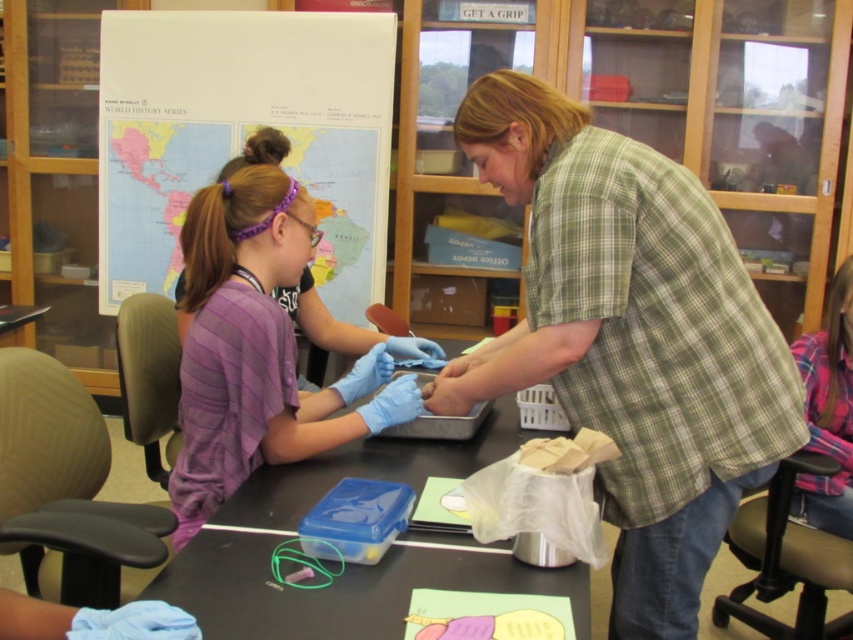
Consider the image. Does world map poster at upper left have a smaller size compared to black plastic table at center?

No.

Identify the location of world map poster at upper left. This screenshot has width=853, height=640. (242, 134).

Where is `world map poster at upper left`? world map poster at upper left is located at coordinates (242, 134).

Consider the image. Who is positioned more to the left, green plaid shirt at center or world map poster at upper left?

From the viewer's perspective, world map poster at upper left appears more on the left side.

Can you confirm if green plaid shirt at center is smaller than world map poster at upper left?

Indeed, green plaid shirt at center has a smaller size compared to world map poster at upper left.

Where is `green plaid shirt at center`? The image size is (853, 640). green plaid shirt at center is located at coordinates (631, 339).

Can you confirm if world map poster at upper left is shorter than purple striped shirt at left?

Incorrect, world map poster at upper left's height does not fall short of purple striped shirt at left's.

In the scene shown: Which is above, world map poster at upper left or purple striped shirt at left?

world map poster at upper left

Is point (320, 209) closer to viewer compared to point (239, 326)?

No, it is not.

At what (x,y) coordinates should I click in order to perform the action: click on world map poster at upper left. Please return your answer as a coordinate pair (x, y). The height and width of the screenshot is (640, 853). Looking at the image, I should click on click(x=242, y=134).